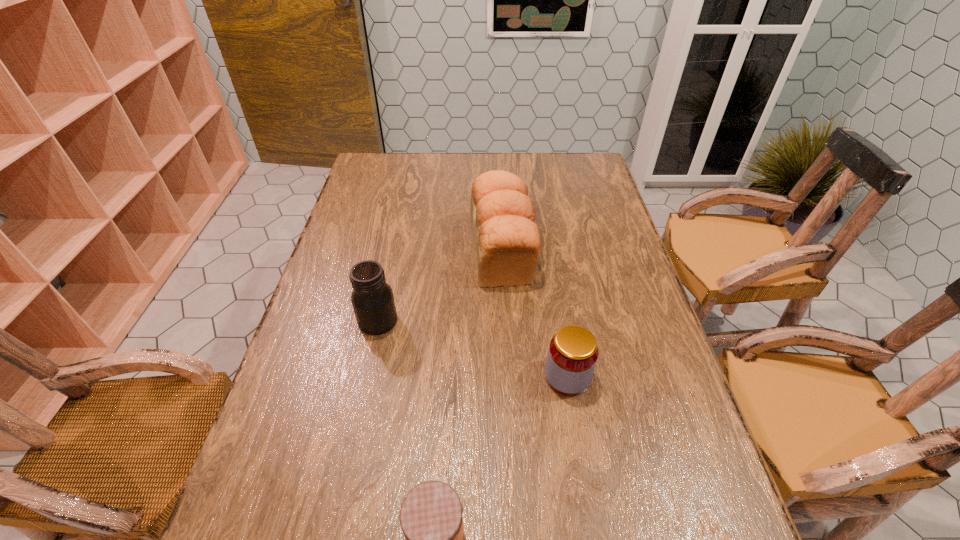
Locate an element on the screen. jar that can be found as the closest to the leftmost jar is located at coordinates (572, 356).

Locate which jar is the closest to the second jar from left to right. Please provide its 2D coordinates. Your answer should be formatted as a tuple, i.e. [(x, y)], where the tuple contains the x and y coordinates of a point satisfying the conditions above.

[(572, 356)]

Image resolution: width=960 pixels, height=540 pixels. What are the coordinates of `free space in the image that satisfies the following two spatial constraints: 1. on the front side of the second nearest jar; 2. on the right side of the tallest jar` in the screenshot? It's located at (366, 377).

Find the location of a particular element. The height and width of the screenshot is (540, 960). free space that satisfies the following two spatial constraints: 1. on the front side of the rightmost jar; 2. on the right side of the bread is located at coordinates (508, 377).